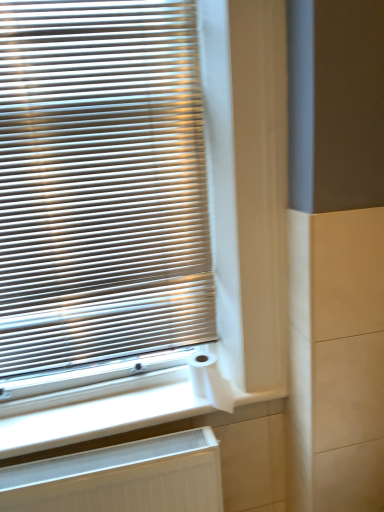
Question: Could you tell me if white matte toilet paper at lower center is facing white ribbed radiator at lower left?

Choices:
 (A) no
 (B) yes

Answer: (A)

Question: From the image's perspective, is white matte toilet paper at lower center located above white ribbed radiator at lower left?

Choices:
 (A) yes
 (B) no

Answer: (A)

Question: Is white matte toilet paper at lower center facing away from white ribbed radiator at lower left?

Choices:
 (A) yes
 (B) no

Answer: (B)

Question: Can you confirm if white matte toilet paper at lower center is taller than white ribbed radiator at lower left?

Choices:
 (A) yes
 (B) no

Answer: (B)

Question: Considering the relative sizes of white matte toilet paper at lower center and white ribbed radiator at lower left in the image provided, is white matte toilet paper at lower center bigger than white ribbed radiator at lower left?

Choices:
 (A) yes
 (B) no

Answer: (B)

Question: Considering the relative positions of white matte toilet paper at lower center and white ribbed radiator at lower left in the image provided, is white matte toilet paper at lower center to the left of white ribbed radiator at lower left from the viewer's perspective?

Choices:
 (A) no
 (B) yes

Answer: (A)

Question: Does white ribbed radiator at lower left come in front of matte silver blinds at left?

Choices:
 (A) no
 (B) yes

Answer: (A)

Question: Considering the relative sizes of white ribbed radiator at lower left and matte silver blinds at left in the image provided, is white ribbed radiator at lower left bigger than matte silver blinds at left?

Choices:
 (A) no
 (B) yes

Answer: (A)

Question: Does white ribbed radiator at lower left have a greater width compared to matte silver blinds at left?

Choices:
 (A) yes
 (B) no

Answer: (A)

Question: From a real-world perspective, is white ribbed radiator at lower left physically above matte silver blinds at left?

Choices:
 (A) yes
 (B) no

Answer: (B)

Question: Are white ribbed radiator at lower left and matte silver blinds at left beside each other?

Choices:
 (A) yes
 (B) no

Answer: (B)

Question: Considering the relative sizes of white ribbed radiator at lower left and matte silver blinds at left in the image provided, is white ribbed radiator at lower left taller than matte silver blinds at left?

Choices:
 (A) yes
 (B) no

Answer: (B)

Question: Is white ribbed radiator at lower left inside matte silver blinds at left?

Choices:
 (A) no
 (B) yes

Answer: (A)